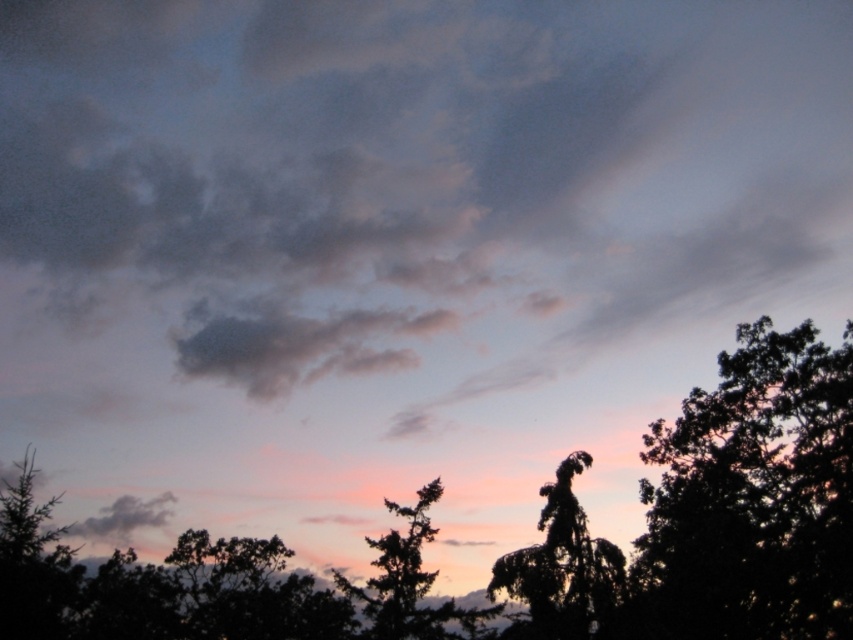
You are an artist painting the sunset scene. You want to add a new tree silhouette between the silhouette tree at center and the dark green leafy tree at lower right. Can you place it there without overlapping either tree?

The silhouette tree at center is below the dark green leafy tree at lower right, so placing a new tree between them would require positioning it above the silhouette tree at center but below the dark green leafy tree at lower right. This is possible as long as there is vertical space between them.

You are standing in the middle of the scene and want to take a photo of both the dark green leafy tree at right and the dark green leafy tree at lower right. Which tree should you focus on first if you want to capture both in the same frame without moving the camera?

The dark green leafy tree at lower right is closer to you than the dark green leafy tree at right. Since the dark green leafy tree at right is taller, you should focus on it first to ensure its full height is captured, then adjust to include the closer tree in the foreground.